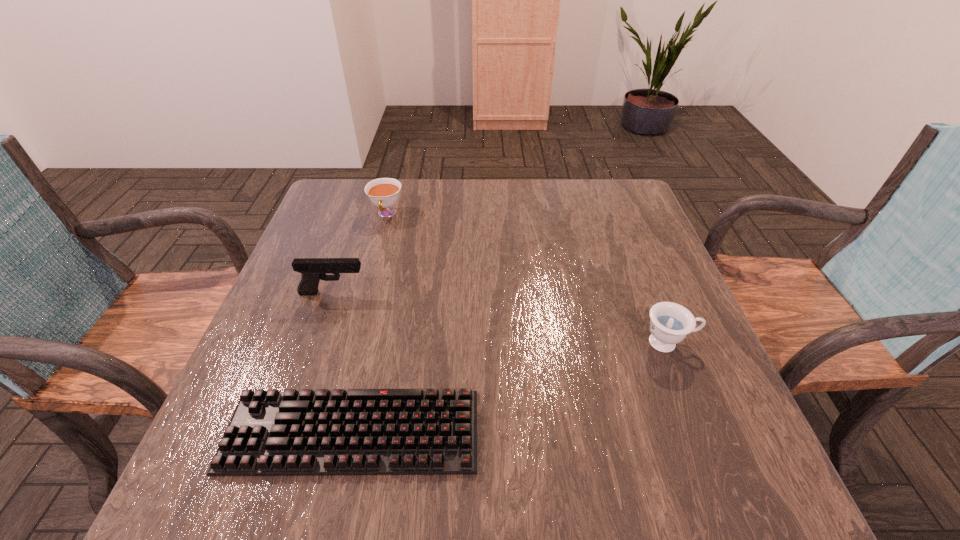
Locate an element on the screen. vacant space positioned 0.340m on the right of the computer keyboard is located at coordinates [x=675, y=432].

Identify the location of object positioned at the far edge. This screenshot has width=960, height=540. (383, 192).

Locate an element on the screen. object that is at the near edge is located at coordinates (360, 431).

Locate an element on the screen. The width and height of the screenshot is (960, 540). pistol located at the left edge is located at coordinates (312, 270).

In order to click on teacup that is positioned at the left edge in this screenshot , I will do `click(383, 192)`.

Where is `computer keyboard located at the left edge`? The height and width of the screenshot is (540, 960). computer keyboard located at the left edge is located at coordinates (360, 431).

Locate an element on the screen. The width and height of the screenshot is (960, 540). object at the right edge is located at coordinates (670, 323).

Identify the location of object situated at the far left corner. The width and height of the screenshot is (960, 540). (383, 192).

Find the location of a particular element. The height and width of the screenshot is (540, 960). object present at the near left corner is located at coordinates (360, 431).

Where is `vacant area at the far edge of the desktop`? Image resolution: width=960 pixels, height=540 pixels. vacant area at the far edge of the desktop is located at coordinates (418, 180).